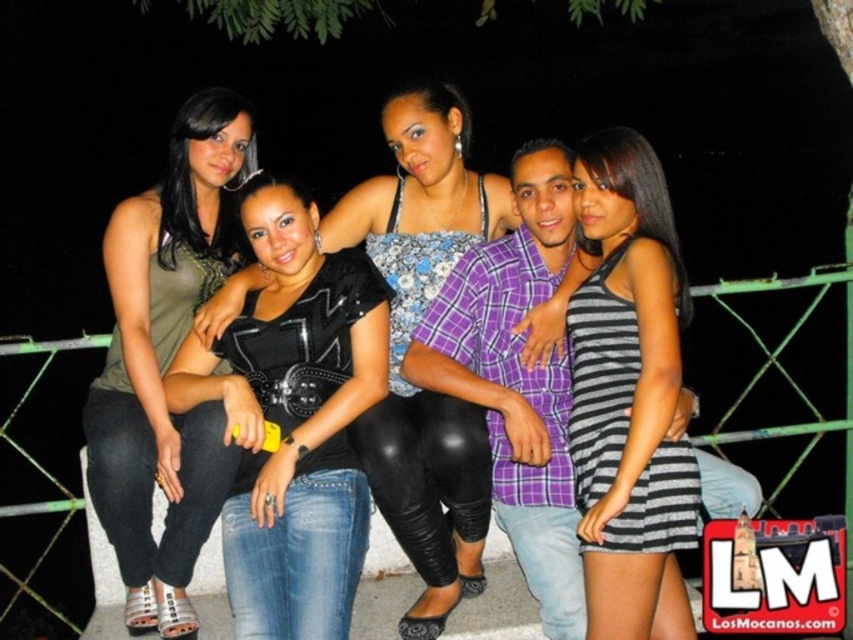
You are a photographer trying to capture a clear shot of the matte green tank top at left and the striped fabric dress at right in the image. Since the scene is dark, you need to adjust your focus. Which object should you focus on first to ensure both are in focus?

The matte green tank top at left is above the striped fabric dress at right, so focusing on the matte green tank top at left first will ensure both are in focus since it is closer to the camera.

You are standing in front of the group of five people sitting on the concrete ledge. You want to place a small gift at the point closer to you between the two points marked as point 1 at position (338, 269) and point 2 at position (635, 161). Which point should you choose?

You should choose point 1 at position (338, 269) because it is closer to you than point 2 at position (635, 161).